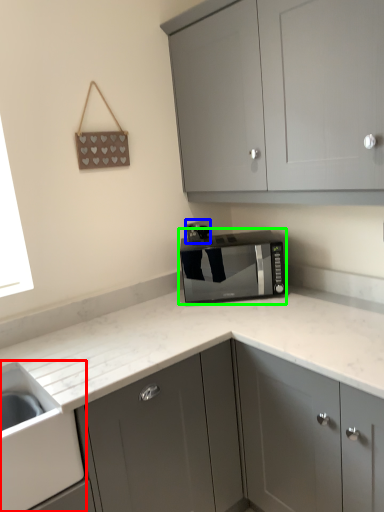
Question: Which object is the closest to the sink (highlighted by a red box)? Choose among these: electric outlet (highlighted by a blue box) or home appliance (highlighted by a green box).

Choices:
 (A) electric outlet
 (B) home appliance

Answer: (B)